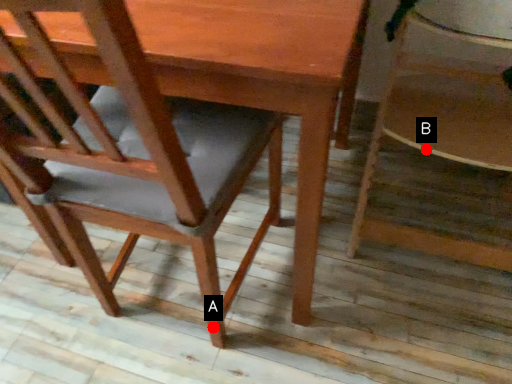
Question: Two points are circled on the image, labeled by A and B beside each circle. Which point is further to the camera?

Choices:
 (A) A is further
 (B) B is further

Answer: (A)